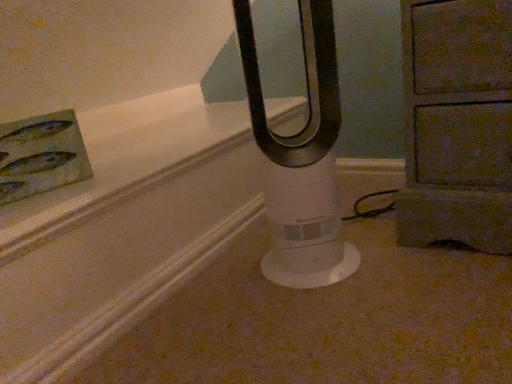
The image size is (512, 384). What do you see at coordinates (301, 159) in the screenshot?
I see `white plastic fan at center` at bounding box center [301, 159].

Locate an element on the screen. white plastic fan at center is located at coordinates click(x=301, y=159).

Identify the location of white plastic fan at center. The width and height of the screenshot is (512, 384). (301, 159).